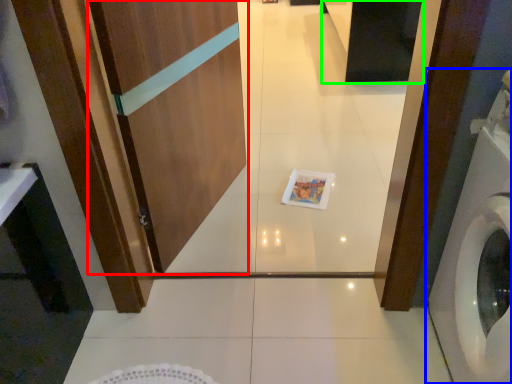
Question: Which object is positioned farthest from screen door (highlighted by a red box)? Select from washing machine (highlighted by a blue box) and cabinetry (highlighted by a green box).

Choices:
 (A) washing machine
 (B) cabinetry

Answer: (B)